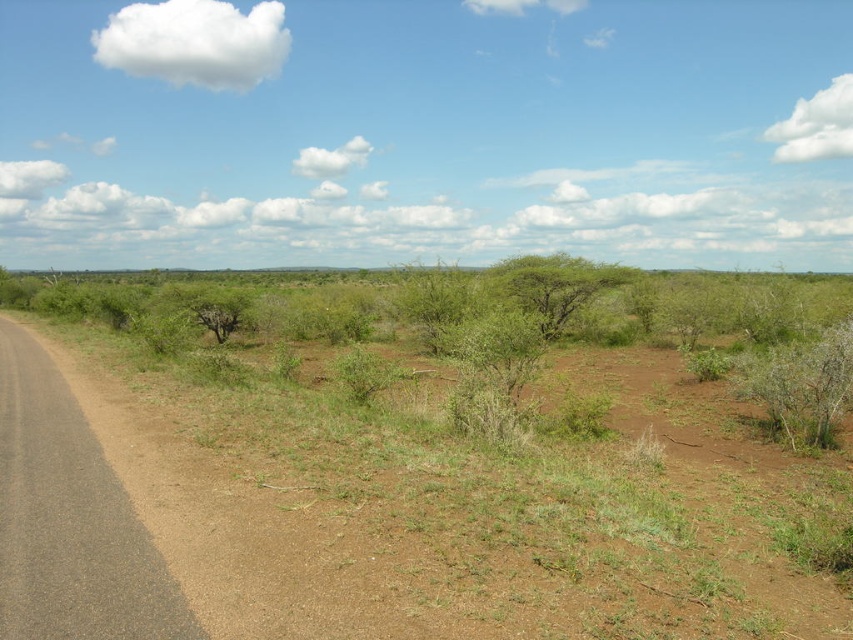
You are a hiker who needs to cross the open landscape to reach the road on the left. You see two green leafy bushes, one at the right and one at the center. If you walk in a straight line from the green leafy bush at right to the green leafy bush at center, will you stay within the open landscape without encountering any obstacles?

The green leafy bush at right is 9.97 meters from the green leafy bush at center. Since the open landscape has only these two bushes and the road, walking in a straight line between them would not encounter any obstacles besides the two bushes themselves.

You are a gardener who wants to plant a new bush that requires a space of 1 meter in width. You see the green leafy bush at right and the green leafy bush at center. Which existing bush has enough space to accommodate the new bush next to it?

The green leafy bush at center has enough space because its width is greater than the green leafy bush at right, meaning it occupies more space and leaves less room for the new bush. Wait, actually, the description says the right bush is less wide than the center one. So the center bush is wider. If the new bush needs 1m, but we don not know the exact widths. Hmm, maybe the answer should be that the center bush is wider, so it might have more space? Or perhaps the question is which has enough space. Since